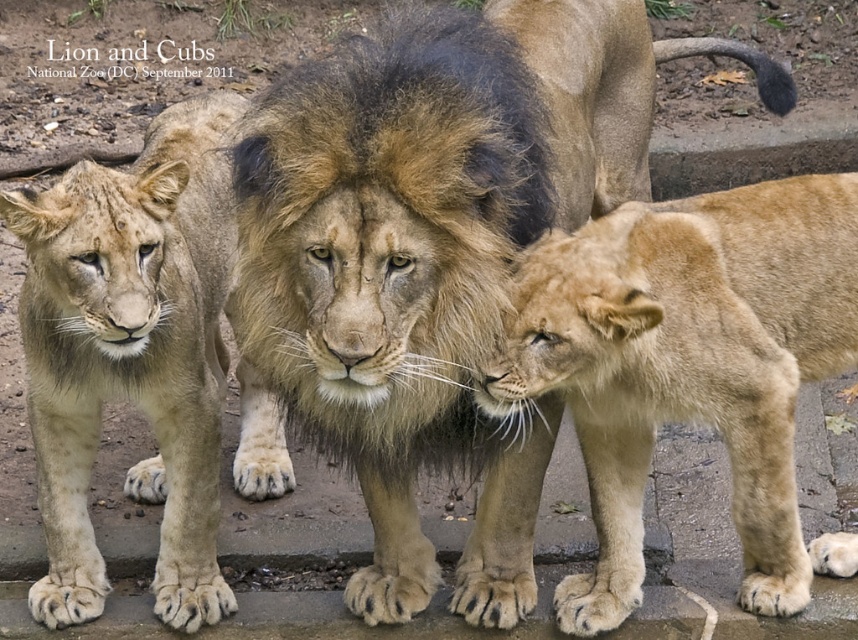
Between golden fur lion at center and light brown fur at center, which one appears on the right side from the viewer's perspective?

golden fur lion at center

Looking at this image, measure the distance between golden fur lion at center and camera.

golden fur lion at center and camera are 2.91 meters apart.

At what (x,y) coordinates should I click in order to perform the action: click on golden fur lion at center. Please return your answer as a coordinate pair (x, y). The width and height of the screenshot is (858, 640). Looking at the image, I should click on (436, 252).

Which is more to the left, golden fur lion at center or golden fur lion cub at lower right?

From the viewer's perspective, golden fur lion at center appears more on the left side.

Does golden fur lion at center have a lesser width compared to golden fur lion cub at lower right?

Incorrect, golden fur lion at center's width is not less than golden fur lion cub at lower right's.

Which is in front, point (420, 19) or point (687, 212)?

Positioned in front is point (420, 19).

The image size is (858, 640). What are the coordinates of `golden fur lion at center` in the screenshot? It's located at (436, 252).

Is point (789, 328) less distant than point (161, 593)?

Yes, it is in front of point (161, 593).

Is point (775, 248) farther from viewer compared to point (98, 205)?

That is True.

At what (x,y) coordinates should I click in order to perform the action: click on golden fur lion cub at lower right. Please return your answer as a coordinate pair (x, y). Looking at the image, I should click on (690, 365).